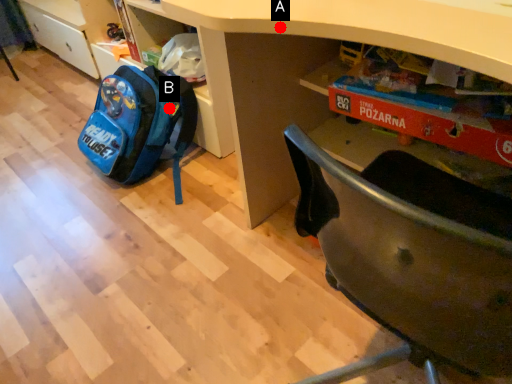
Question: Two points are circled on the image, labeled by A and B beside each circle. Which point appears closest to the camera in this image?

Choices:
 (A) A is closer
 (B) B is closer

Answer: (A)